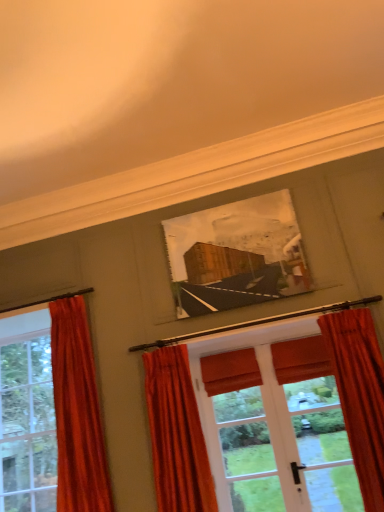
Question: Is there a large distance between velvet orange curtain at lower right, placed as the first curtain when sorted from right to left, and velvet red curtain at left, the 1th curtain in the left-to-right sequence?

Choices:
 (A) yes
 (B) no

Answer: (A)

Question: Considering the relative sizes of velvet orange curtain at lower right, placed as the first curtain when sorted from right to left, and velvet red curtain at left, the 3th curtain when ordered from right to left, in the image provided, is velvet orange curtain at lower right, placed as the first curtain when sorted from right to left, shorter than velvet red curtain at left, the 3th curtain when ordered from right to left,?

Choices:
 (A) no
 (B) yes

Answer: (B)

Question: Is velvet orange curtain at lower right, placed as the first curtain when sorted from right to left, wider than velvet red curtain at left, the 3th curtain when ordered from right to left?

Choices:
 (A) yes
 (B) no

Answer: (B)

Question: From the image's perspective, is velvet orange curtain at lower right, the 3th curtain when ordered from left to right, over velvet red curtain at left, the 1th curtain in the left-to-right sequence?

Choices:
 (A) yes
 (B) no

Answer: (A)

Question: From the image's perspective, does velvet orange curtain at lower right, the 3th curtain when ordered from left to right, appear lower than velvet red curtain at left, the 1th curtain in the left-to-right sequence?

Choices:
 (A) yes
 (B) no

Answer: (B)

Question: Considering the relative positions of velvet orange curtain at center, which is the 2th curtain from right to left, and velvet orange curtain at lower right, the 3th curtain when ordered from left to right, in the image provided, is velvet orange curtain at center, which is the 2th curtain from right to left, to the left or to the right of velvet orange curtain at lower right, the 3th curtain when ordered from left to right,?

Choices:
 (A) left
 (B) right

Answer: (A)

Question: Considering the positions of point (200, 493) and point (345, 362), is point (200, 493) closer or farther from the camera than point (345, 362)?

Choices:
 (A) farther
 (B) closer

Answer: (B)

Question: From the image's perspective, is velvet orange curtain at center, which is the 2th curtain from right to left, above or below velvet orange curtain at lower right, the 3th curtain when ordered from left to right?

Choices:
 (A) below
 (B) above

Answer: (A)

Question: Would you say velvet orange curtain at center, the second curtain viewed from the left, is inside or outside velvet orange curtain at lower right, the 3th curtain when ordered from left to right?

Choices:
 (A) inside
 (B) outside

Answer: (B)

Question: Considering the positions of velvet orange curtain at center, the second curtain viewed from the left, and matte orange curtain at left in the image, is velvet orange curtain at center, the second curtain viewed from the left, wider or thinner than matte orange curtain at left?

Choices:
 (A) thin
 (B) wide

Answer: (A)

Question: Relative to matte orange curtain at left, is velvet orange curtain at center, the second curtain viewed from the left, in front or behind?

Choices:
 (A) front
 (B) behind

Answer: (A)

Question: From a real-world perspective, is velvet orange curtain at center, which is the 2th curtain from right to left, physically located above or below matte orange curtain at left?

Choices:
 (A) below
 (B) above

Answer: (A)

Question: Looking at the image, does velvet orange curtain at center, the second curtain viewed from the left, seem bigger or smaller compared to matte orange curtain at left?

Choices:
 (A) small
 (B) big

Answer: (A)

Question: Is velvet red curtain at left, the 3th curtain when ordered from right to left, spatially inside wooden picture frame at center, or outside of it?

Choices:
 (A) outside
 (B) inside

Answer: (A)

Question: Looking at the image, does velvet red curtain at left, the 3th curtain when ordered from right to left, seem bigger or smaller compared to wooden picture frame at center?

Choices:
 (A) big
 (B) small

Answer: (A)